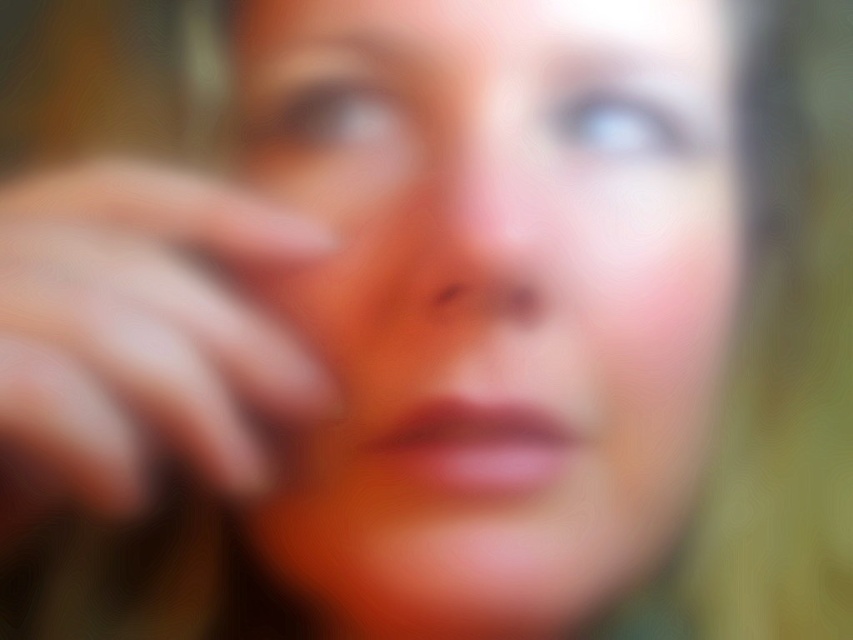
Question: Considering the relative positions of smooth skin face at center and pink smooth nose at center in the image provided, where is smooth skin face at center located with respect to pink smooth nose at center?

Choices:
 (A) above
 (B) below

Answer: (B)

Question: Among these points, which one is nearest to the camera?

Choices:
 (A) (663, 300)
 (B) (471, 186)

Answer: (B)

Question: Which is nearer to the pink smooth nose at center?

Choices:
 (A) smooth skin hand at center
 (B) smooth skin face at center

Answer: (B)

Question: Which object is farther from the camera taking this photo?

Choices:
 (A) pink smooth nose at center
 (B) smooth skin face at center

Answer: (B)

Question: Is smooth skin face at center in front of smooth skin hand at center?

Choices:
 (A) no
 (B) yes

Answer: (A)

Question: Can you confirm if smooth skin face at center is thinner than pink smooth nose at center?

Choices:
 (A) no
 (B) yes

Answer: (A)